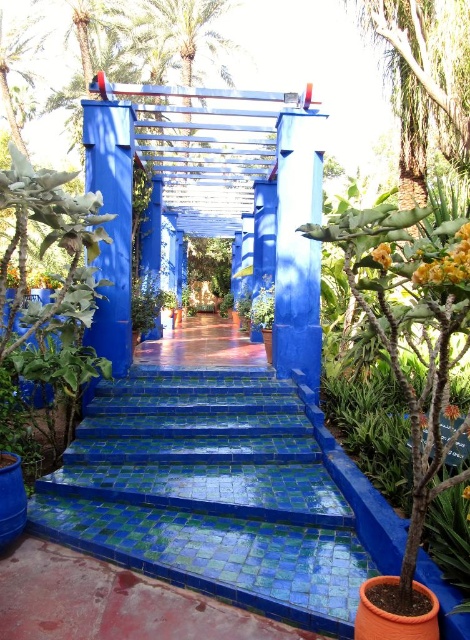
Does blue mosaic tile stairs at center lie behind green leafy palm tree at upper center?

No, it is not.

Does blue mosaic tile stairs at center appear on the right side of green leafy palm tree at upper center?

Yes, blue mosaic tile stairs at center is to the right of green leafy palm tree at upper center.

What do you see at coordinates (211, 493) in the screenshot?
I see `blue mosaic tile stairs at center` at bounding box center [211, 493].

The width and height of the screenshot is (470, 640). I want to click on blue mosaic tile stairs at center, so click(211, 493).